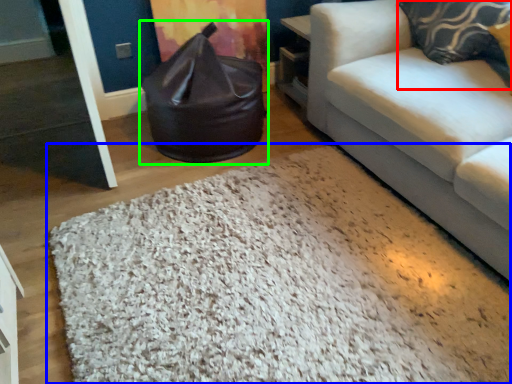
Question: Which object is the closest to the pillow (highlighted by a red box)? Choose among these: mat (highlighted by a blue box) or bean bag chair (highlighted by a green box).

Choices:
 (A) mat
 (B) bean bag chair

Answer: (B)